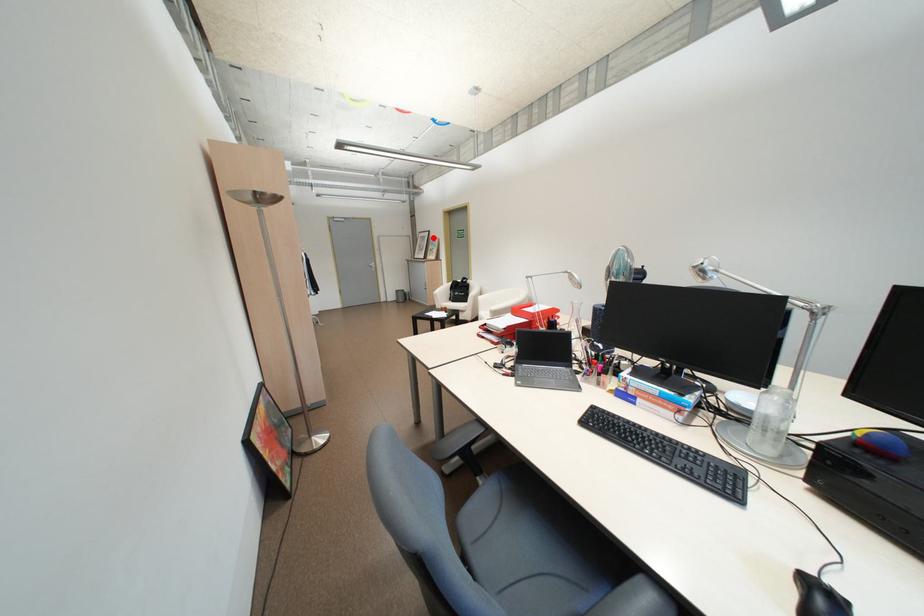
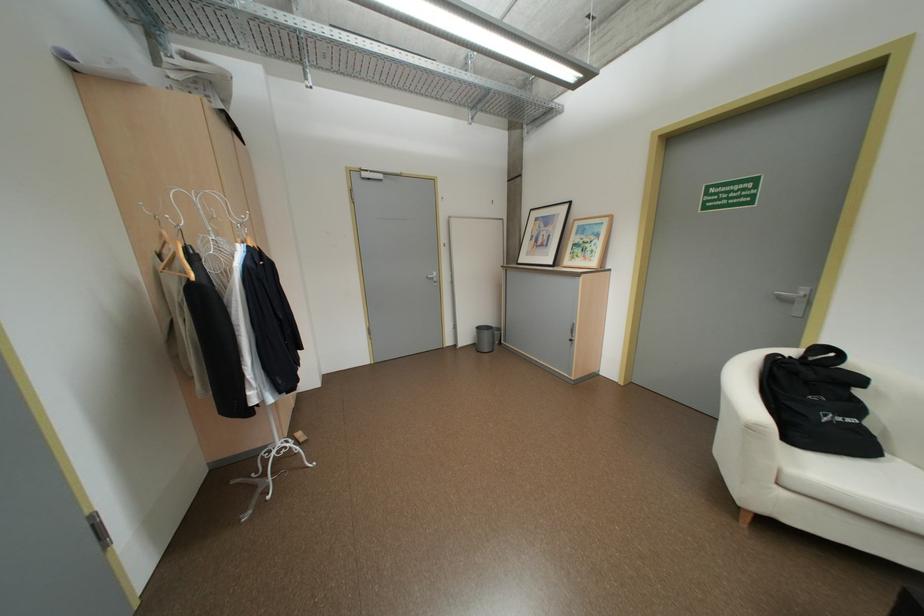
Question: I am providing you with two images of the same scene from different viewpoints. A red point is shown in image1. For the corresponding object point in image2, is it positioned nearer or farther from the camera?

Choices:
 (A) Nearer
 (B) Farther

Answer: (B)